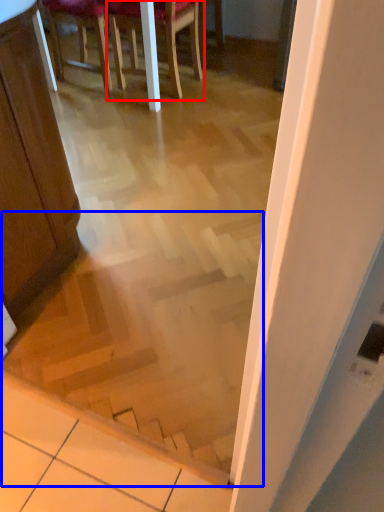
Question: Which object is further to the camera taking this photo, chair (highlighted by a red box) or stairwell (highlighted by a blue box)?

Choices:
 (A) chair
 (B) stairwell

Answer: (A)